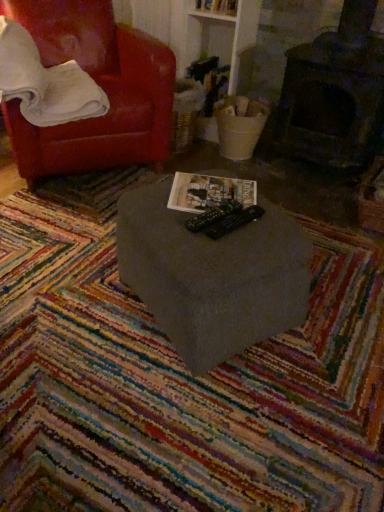
Question: Looking at their shapes, would you say white soft pillow at upper left is wider or thinner than matte paper magazine at center?

Choices:
 (A) wide
 (B) thin

Answer: (A)

Question: Is white soft pillow at upper left taller or shorter than matte paper magazine at center?

Choices:
 (A) tall
 (B) short

Answer: (A)

Question: Estimate the real-world distances between objects in this image. Which object is closer to the white soft pillow at upper left?

Choices:
 (A) multicolored woven mat at center
 (B) matte gray table at center
 (C) matte paper magazine at center
 (D) leather red armchair at left

Answer: (D)

Question: Based on their relative distances, which object is farther from the matte gray table at center?

Choices:
 (A) multicolored woven mat at center
 (B) white soft pillow at upper left
 (C) matte paper magazine at center
 (D) leather red armchair at left

Answer: (D)